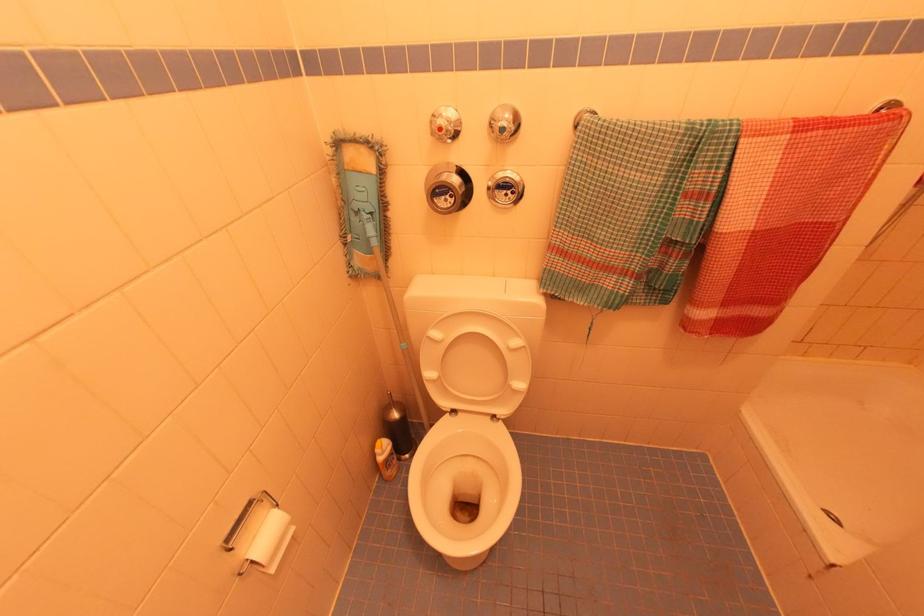
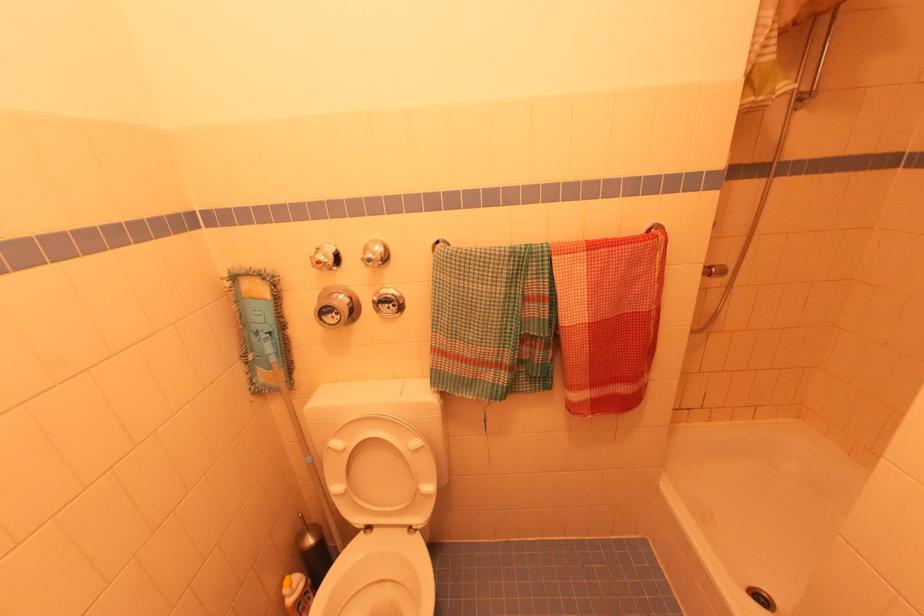
Question: The first image is from the beginning of the video and the second image is from the end. How did the camera likely rotate when shooting the video?

Choices:
 (A) Left
 (B) Right
 (C) Up
 (D) Down

Answer: (C)